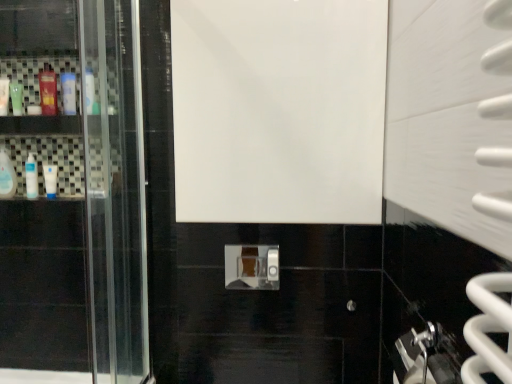
Question: Is the depth of translucent plastic mouthwash at upper left, marked as the second mouthwash in a right-to-left arrangement, less than that of white glossy door at center?

Choices:
 (A) no
 (B) yes

Answer: (A)

Question: Does translucent plastic mouthwash at upper left, acting as the fifth mouthwash starting from the left, have a greater width compared to white glossy door at center?

Choices:
 (A) no
 (B) yes

Answer: (A)

Question: Considering the relative sizes of translucent plastic mouthwash at upper left, acting as the fifth mouthwash starting from the left, and white glossy door at center in the image provided, is translucent plastic mouthwash at upper left, acting as the fifth mouthwash starting from the left, shorter than white glossy door at center?

Choices:
 (A) yes
 (B) no

Answer: (A)

Question: Considering the relative sizes of translucent plastic mouthwash at upper left, marked as the second mouthwash in a right-to-left arrangement, and white glossy door at center in the image provided, is translucent plastic mouthwash at upper left, marked as the second mouthwash in a right-to-left arrangement, taller than white glossy door at center?

Choices:
 (A) yes
 (B) no

Answer: (B)

Question: From a real-world perspective, is translucent plastic mouthwash at upper left, marked as the second mouthwash in a right-to-left arrangement, on white glossy door at center?

Choices:
 (A) no
 (B) yes

Answer: (B)

Question: From the image's perspective, is translucent plastic mouthwash at upper left, acting as the fifth mouthwash starting from the left, located beneath white glossy door at center?

Choices:
 (A) yes
 (B) no

Answer: (B)

Question: Is white glossy tube at left, which appears as the 3th mouthwash when viewed from the right, completely or partially outside of translucent plastic mouthwash at upper left, acting as the fifth mouthwash starting from the left?

Choices:
 (A) yes
 (B) no

Answer: (A)

Question: Does white glossy tube at left, which appears as the 3th mouthwash when viewed from the right, come behind translucent plastic mouthwash at upper left, acting as the fifth mouthwash starting from the left?

Choices:
 (A) no
 (B) yes

Answer: (B)

Question: Considering the relative sizes of white glossy tube at left, which appears as the 3th mouthwash when viewed from the right, and translucent plastic mouthwash at upper left, marked as the second mouthwash in a right-to-left arrangement, in the image provided, is white glossy tube at left, which appears as the 3th mouthwash when viewed from the right, taller than translucent plastic mouthwash at upper left, marked as the second mouthwash in a right-to-left arrangement,?

Choices:
 (A) yes
 (B) no

Answer: (B)

Question: Can you confirm if white glossy tube at left, the 4th mouthwash in the left-to-right sequence, is thinner than translucent plastic mouthwash at upper left, marked as the second mouthwash in a right-to-left arrangement?

Choices:
 (A) no
 (B) yes

Answer: (B)

Question: Is white glossy tube at left, the 4th mouthwash in the left-to-right sequence, to the right of translucent plastic mouthwash at upper left, acting as the fifth mouthwash starting from the left, from the viewer's perspective?

Choices:
 (A) no
 (B) yes

Answer: (A)

Question: Is white glossy tube at left, the 4th mouthwash in the left-to-right sequence, in contact with translucent plastic mouthwash at upper left, acting as the fifth mouthwash starting from the left?

Choices:
 (A) no
 (B) yes

Answer: (A)

Question: From the image's perspective, is white glossy bottle at left, which is the sixth mouthwash from left to right, under white glossy bottle at left, acting as the fourth mouthwash starting from the right?

Choices:
 (A) yes
 (B) no

Answer: (B)